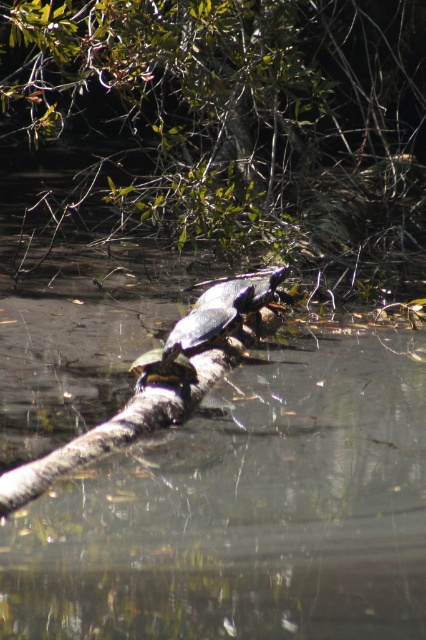
In the scene shown: Does shiny dark green tortoise at center have a larger size compared to shiny brown tortoise at center?

Yes, shiny dark green tortoise at center is bigger than shiny brown tortoise at center.

Between shiny dark green tortoise at center and shiny brown tortoise at center, which one has less height?

shiny brown tortoise at center is shorter.

Find the location of a particular element. shiny dark green tortoise at center is located at coordinates (210, 324).

I want to click on shiny dark green tortoise at center, so click(x=210, y=324).

Can you confirm if green leafy tree at upper center is shorter than shiny brown tortoise at center?

No, green leafy tree at upper center is not shorter than shiny brown tortoise at center.

Is point (265, 10) farther from viewer compared to point (184, 362)?

Yes, it is behind point (184, 362).

Identify the location of green leafy tree at upper center. The image size is (426, 640). (230, 118).

Who is taller, clear water at branch center or shiny dark green tortoise at center?

With more height is clear water at branch center.

Can you confirm if clear water at branch center is bigger than shiny dark green tortoise at center?

Yes.

This screenshot has width=426, height=640. What do you see at coordinates (244, 512) in the screenshot? I see `clear water at branch center` at bounding box center [244, 512].

Locate an element on the screen. The width and height of the screenshot is (426, 640). clear water at branch center is located at coordinates (244, 512).